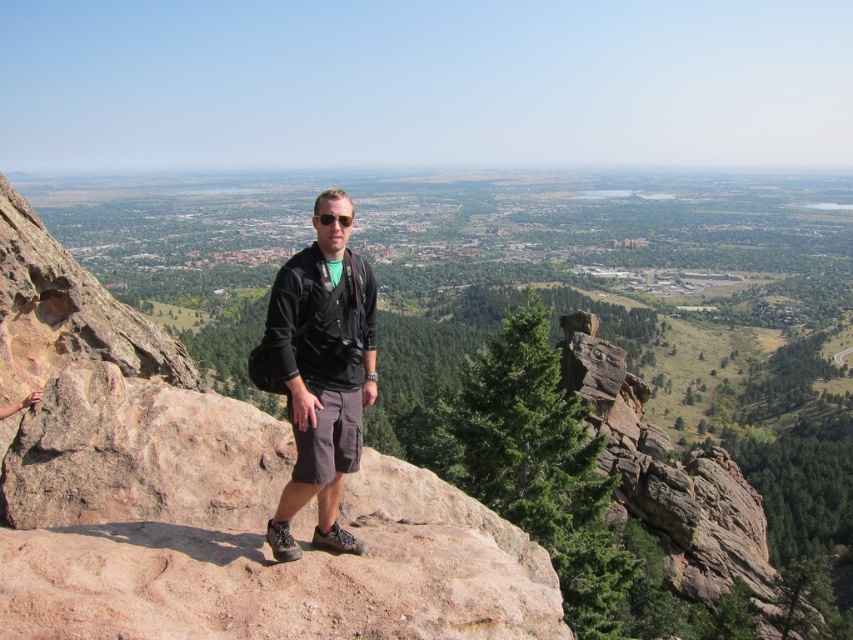
Question: Is black fabric jacket at center above matte black sunglasses at center?

Choices:
 (A) no
 (B) yes

Answer: (A)

Question: Does brown rough rock at center appear on the left side of matte black sunglasses at center?

Choices:
 (A) yes
 (B) no

Answer: (A)

Question: Does brown rough rock at center lie in front of black fabric jacket at center?

Choices:
 (A) yes
 (B) no

Answer: (A)

Question: Based on their relative distances, which object is farther from the black fabric jacket at center?

Choices:
 (A) matte black sunglasses at center
 (B) brown rough rock at center

Answer: (B)

Question: Which point is closer to the camera?

Choices:
 (A) black fabric jacket at center
 (B) matte black sunglasses at center
 (C) brown rough rock at center

Answer: (C)

Question: Which of the following is the farthest from the observer?

Choices:
 (A) (331, 218)
 (B) (103, 486)

Answer: (A)